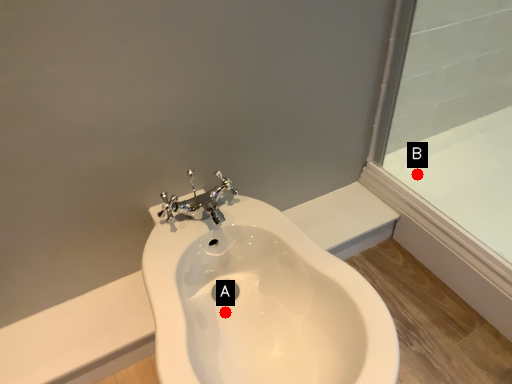
Question: Two points are circled on the image, labeled by A and B beside each circle. Which point is closer to the camera taking this photo?

Choices:
 (A) A is closer
 (B) B is closer

Answer: (A)